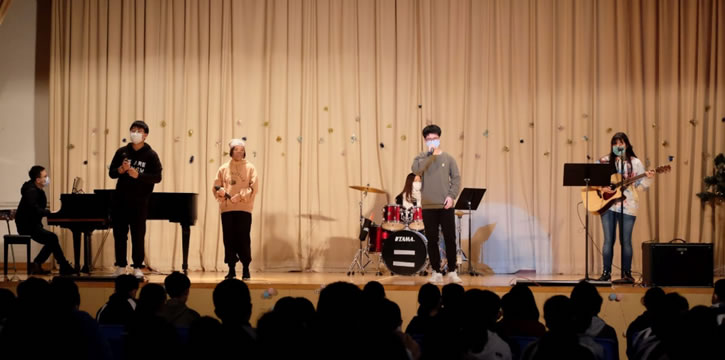
You are a GUI agent. You are given a task and a screenshot of the screen. Output one action in this format:
    pyautogui.click(x=<x>, y=<y>)
    Task: Click on the stage
    
    Given the screenshot: What is the action you would take?
    pyautogui.click(x=289, y=277), pyautogui.click(x=198, y=277), pyautogui.click(x=492, y=277), pyautogui.click(x=610, y=310), pyautogui.click(x=399, y=300), pyautogui.click(x=257, y=300), pyautogui.click(x=194, y=294), pyautogui.click(x=91, y=289)